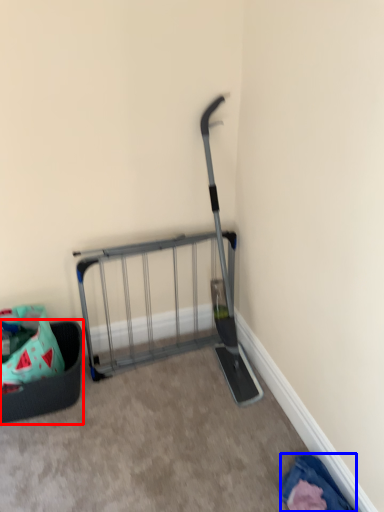
Question: Among these objects, which one is farthest to the camera, furniture (highlighted by a red box) or clothing (highlighted by a blue box)?

Choices:
 (A) furniture
 (B) clothing

Answer: (A)